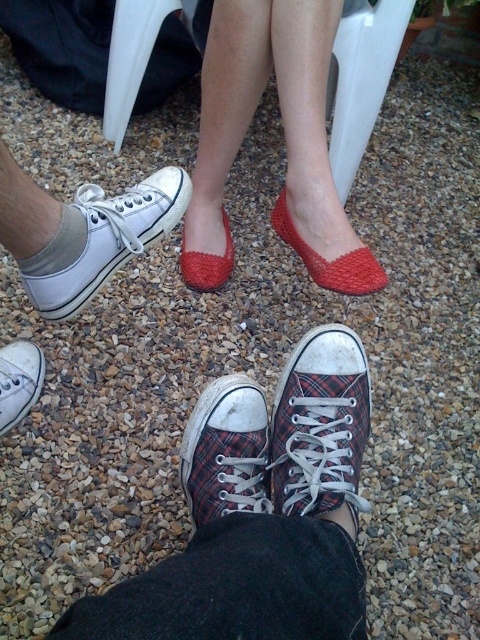
Can you confirm if white canvas shoe at lower left is positioned to the left of plaid canvas shoe at lower center?

Indeed, white canvas shoe at lower left is positioned on the left side of plaid canvas shoe at lower center.

Does white canvas shoe at lower left have a smaller size compared to plaid canvas shoe at lower center?

Actually, white canvas shoe at lower left might be larger than plaid canvas shoe at lower center.

Who is more forward, (54, 273) or (261, 410)?

Point (54, 273)

Image resolution: width=480 pixels, height=640 pixels. Find the location of `white canvas shoe at lower left`. white canvas shoe at lower left is located at coordinates (101, 240).

Which is above, plaid canvas sneakers at center or white cotton sock at lower left?

Positioned higher is white cotton sock at lower left.

Can you confirm if plaid canvas sneakers at center is positioned above white cotton sock at lower left?

No, plaid canvas sneakers at center is not above white cotton sock at lower left.

Image resolution: width=480 pixels, height=640 pixels. In order to click on plaid canvas sneakers at center in this screenshot , I will do `click(260, 513)`.

The height and width of the screenshot is (640, 480). Find the location of `plaid canvas sneakers at center`. plaid canvas sneakers at center is located at coordinates (260, 513).

Which of these two, white canvas shoe at lower left or white cotton sock at lower left, stands shorter?

white cotton sock at lower left is shorter.

Does white canvas shoe at lower left have a smaller size compared to white cotton sock at lower left?

Incorrect, white canvas shoe at lower left is not smaller in size than white cotton sock at lower left.

Image resolution: width=480 pixels, height=640 pixels. What are the coordinates of `white canvas shoe at lower left` in the screenshot? It's located at (101, 240).